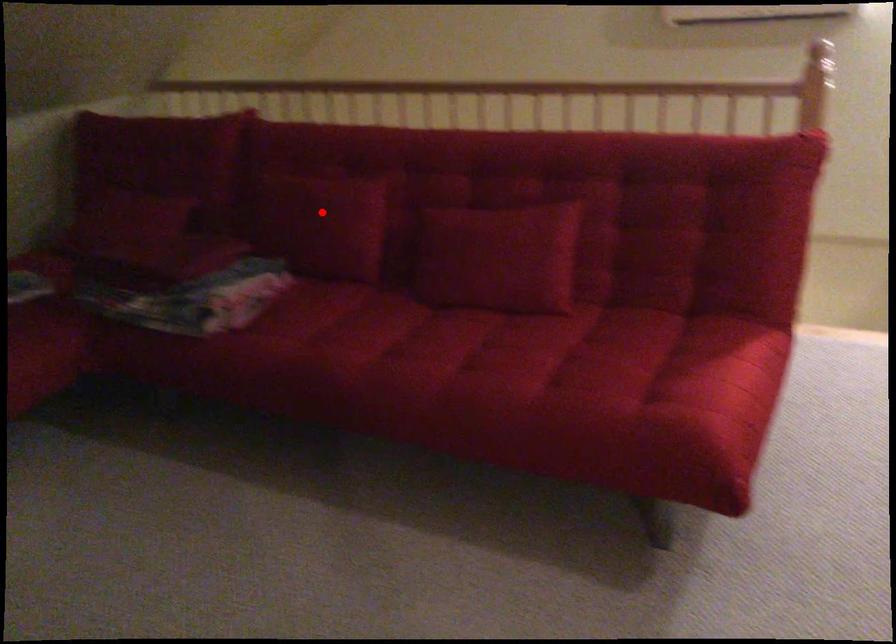
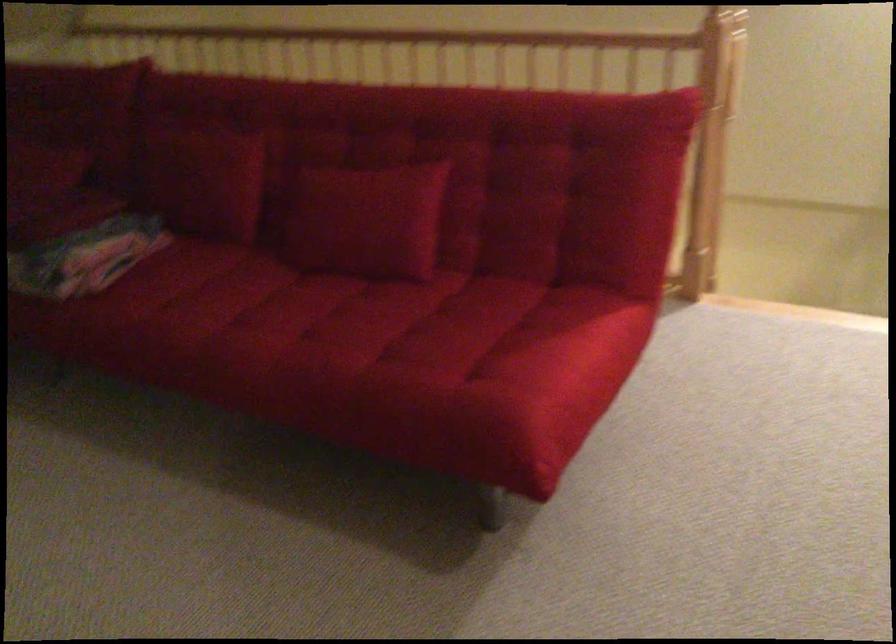
Find the pixel in the second image that matches the highlighted location in the first image.

(202, 176)